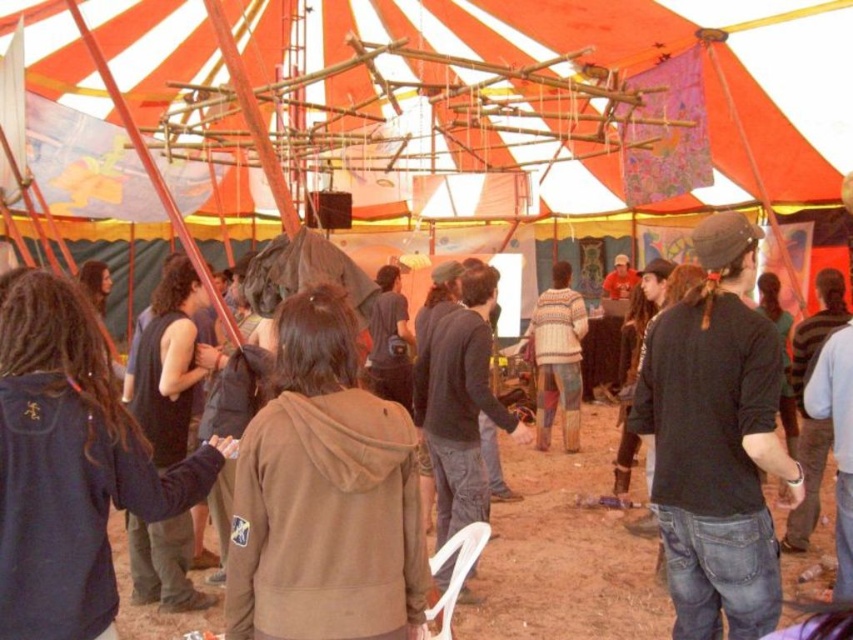
Question: Is the position of dark brown hair at left more distant than that of knitted sweater at center?

Choices:
 (A) yes
 (B) no

Answer: (B)

Question: Is black matte shirt at center above brown cotton hoodie at center?

Choices:
 (A) yes
 (B) no

Answer: (A)

Question: Which object is farther from the camera taking this photo?

Choices:
 (A) black matte shirt at center
 (B) brown cotton hoodie at center

Answer: (B)

Question: Which of the following is the closest to the observer?

Choices:
 (A) (149, 525)
 (B) (351, 449)
 (C) (573, 323)
 (D) (714, 467)

Answer: (B)

Question: Can you confirm if dark blue hoodie at center is wider than dark brown hair at left?

Choices:
 (A) no
 (B) yes

Answer: (A)

Question: Based on their relative distances, which object is nearer to the brown fleece jacket at center?

Choices:
 (A) dark blue hoodie at center
 (B) black matte shirt at center

Answer: (A)